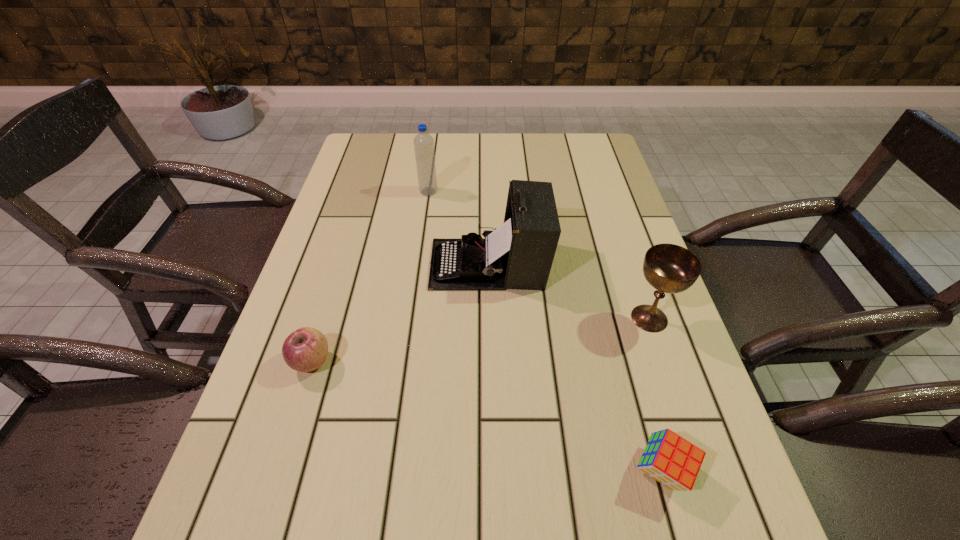
This screenshot has height=540, width=960. In the image, there is a desktop. In order to click on free space at the far left corner in this screenshot , I will do `click(370, 146)`.

This screenshot has width=960, height=540. In the image, there is a desktop. What are the coordinates of `vacant space at the far right corner` in the screenshot? It's located at (587, 154).

What are the coordinates of `free space between the cube and the apple` in the screenshot? It's located at (487, 417).

Locate an element on the screen. free area in between the cube and the chalice is located at coordinates (656, 395).

Where is `blank region between the fourth nearest object and the second nearest object`? Image resolution: width=960 pixels, height=540 pixels. blank region between the fourth nearest object and the second nearest object is located at coordinates (400, 313).

Where is `vacant space that's between the nearest object and the second farthest object`? The height and width of the screenshot is (540, 960). vacant space that's between the nearest object and the second farthest object is located at coordinates (575, 368).

Find the location of `vacant space that's between the cube and the third farthest object`. vacant space that's between the cube and the third farthest object is located at coordinates (656, 395).

Locate an element on the screen. This screenshot has width=960, height=540. free space between the leftmost object and the fourth nearest object is located at coordinates (400, 313).

This screenshot has width=960, height=540. Identify the location of unoccupied position between the second farthest object and the apple. (400, 313).

Locate an element on the screen. The width and height of the screenshot is (960, 540). free spot between the third tallest object and the typewriter is located at coordinates (569, 291).